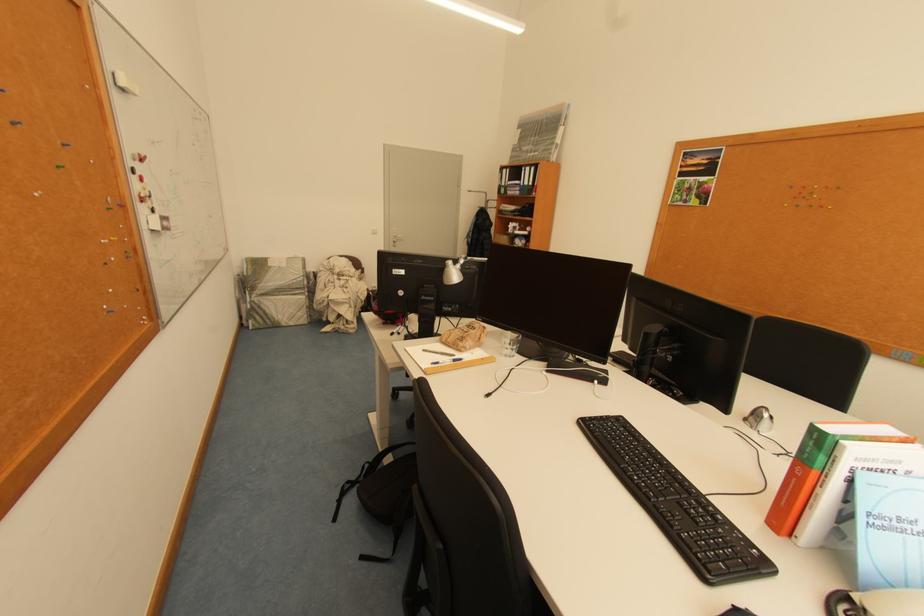
Identify the location of black backpack. The width and height of the screenshot is (924, 616). tap(383, 493).